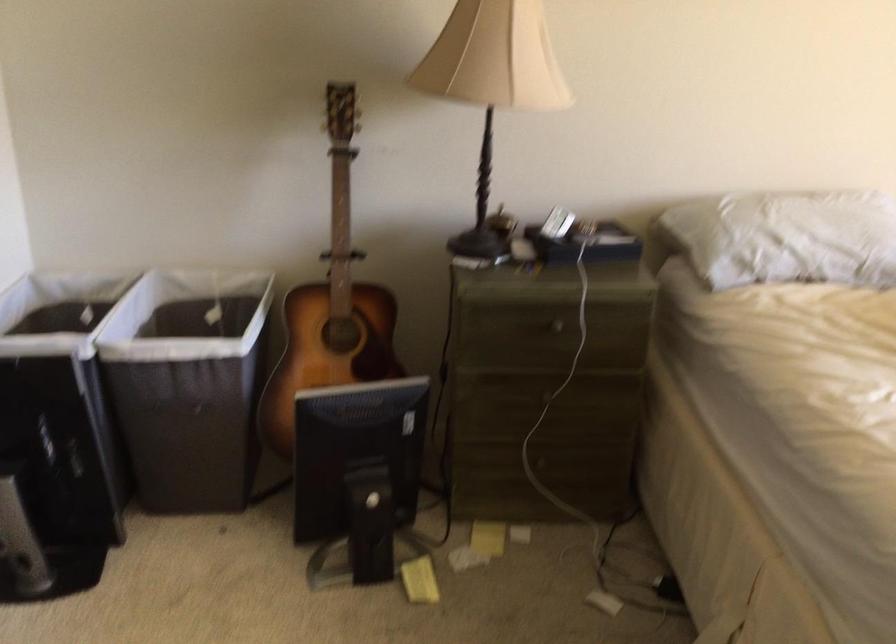
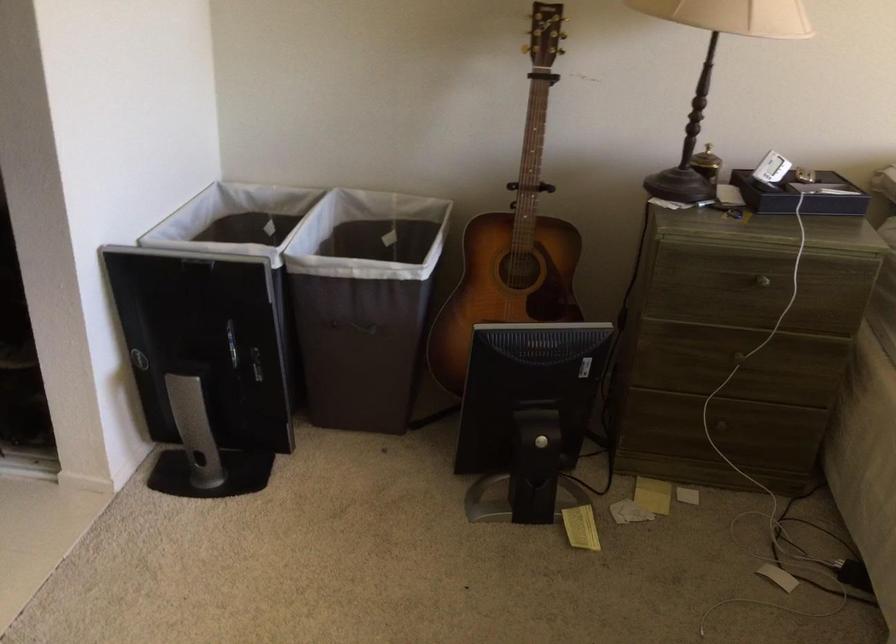
Locate, in the second image, the point that corresponds to (558,327) in the first image.

(762, 281)